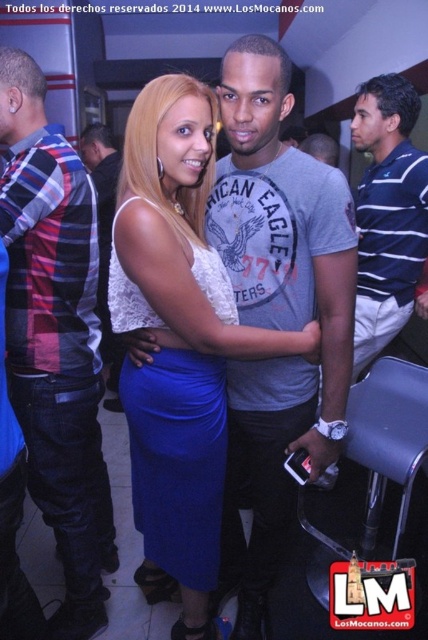
Looking at this image, you are at a party and want to take a photo of the lace fabric dress at center and the matte plaid shirt at left. Which object should you focus on first if you want to capture both in the same frame?

The lace fabric dress at center is positioned under the matte plaid shirt at left, so you should focus on the matte plaid shirt at left first to ensure both are in the frame.

Looking at this image, you are standing in the center of the room and see the point marked at coordinates (178, 344). What object is located exactly at that point?

The point at coordinates (178, 344) marks the lace fabric dress at center.

What are the coordinates of the lace fabric dress at center in the image?

The lace fabric dress at center is located at coordinates point (178, 344).